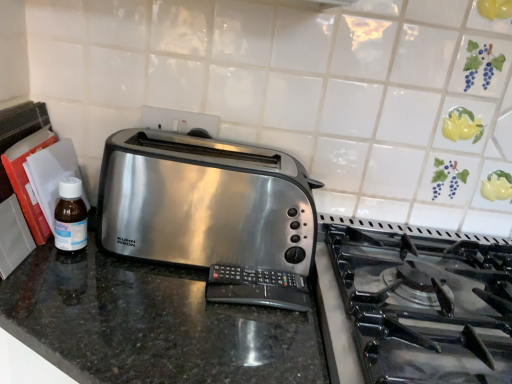
Question: Does satin metallic toaster at center turn towards translucent plastic bottle at left?

Choices:
 (A) yes
 (B) no

Answer: (B)

Question: Is satin metallic toaster at center not inside translucent plastic bottle at left?

Choices:
 (A) no
 (B) yes

Answer: (B)

Question: From the image's perspective, is satin metallic toaster at center under translucent plastic bottle at left?

Choices:
 (A) yes
 (B) no

Answer: (B)

Question: Is satin metallic toaster at center smaller than translucent plastic bottle at left?

Choices:
 (A) yes
 (B) no

Answer: (B)

Question: From a real-world perspective, is satin metallic toaster at center beneath translucent plastic bottle at left?

Choices:
 (A) yes
 (B) no

Answer: (B)

Question: Choose the correct answer: Is translucent plastic bottle at left inside satin metallic toaster at center or outside it?

Choices:
 (A) outside
 (B) inside

Answer: (A)

Question: From a real-world perspective, is translucent plastic bottle at left physically located above or below satin metallic toaster at center?

Choices:
 (A) above
 (B) below

Answer: (B)

Question: In the image, is translucent plastic bottle at left positioned in front of or behind satin metallic toaster at center?

Choices:
 (A) front
 (B) behind

Answer: (B)

Question: Based on their positions, is translucent plastic bottle at left located to the left or right of satin metallic toaster at center?

Choices:
 (A) left
 (B) right

Answer: (A)

Question: Is shiny granite counter at center in front of or behind translucent plastic bottle at left in the image?

Choices:
 (A) front
 (B) behind

Answer: (A)

Question: In terms of height, does shiny granite counter at center look taller or shorter compared to translucent plastic bottle at left?

Choices:
 (A) tall
 (B) short

Answer: (A)

Question: Looking at the image, does shiny granite counter at center seem bigger or smaller compared to translucent plastic bottle at left?

Choices:
 (A) big
 (B) small

Answer: (A)

Question: Visually, is shiny granite counter at center positioned to the left or to the right of translucent plastic bottle at left?

Choices:
 (A) left
 (B) right

Answer: (B)

Question: From the image's perspective, is shiny granite counter at center positioned above or below satin metallic toaster at center?

Choices:
 (A) below
 (B) above

Answer: (A)

Question: Is shiny granite counter at center inside the boundaries of satin metallic toaster at center, or outside?

Choices:
 (A) outside
 (B) inside

Answer: (A)